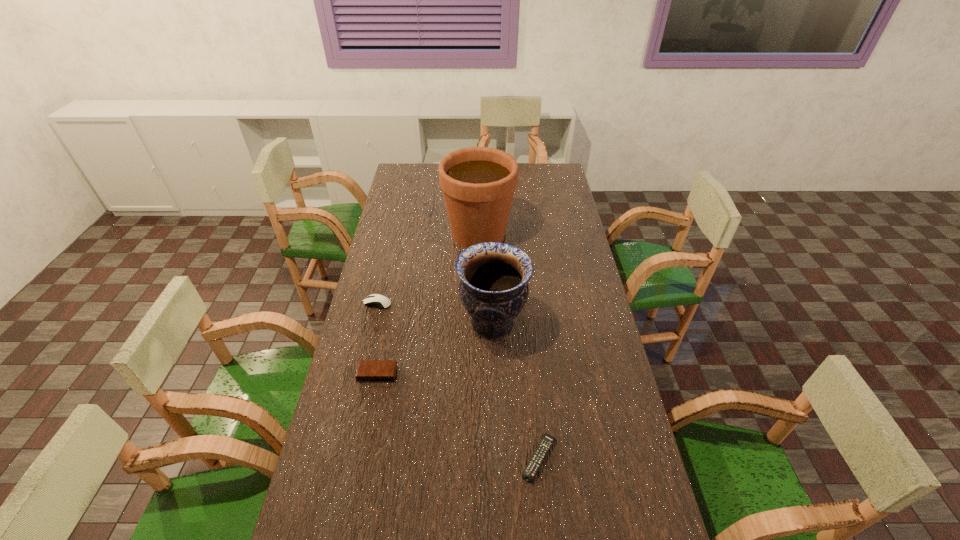
Find the location of a particular element. This screenshot has width=960, height=540. vacant space that satisfies the following two spatial constraints: 1. on the front handle of the fourth shortest object; 2. on the front face of the fourth tallest object is located at coordinates (494, 374).

At what (x,y) coordinates should I click in order to perform the action: click on free space that satisfies the following two spatial constraints: 1. on the front face of the second shortest object; 2. on the left side of the nearest object. Please return your answer as a coordinate pair (x, y). The image size is (960, 540). Looking at the image, I should click on coord(361,458).

At what (x,y) coordinates should I click in order to perform the action: click on free space that satisfies the following two spatial constraints: 1. on the back side of the farthest object; 2. on the right side of the third shortest object. Please return your answer as a coordinate pair (x, y). Looking at the image, I should click on click(394, 234).